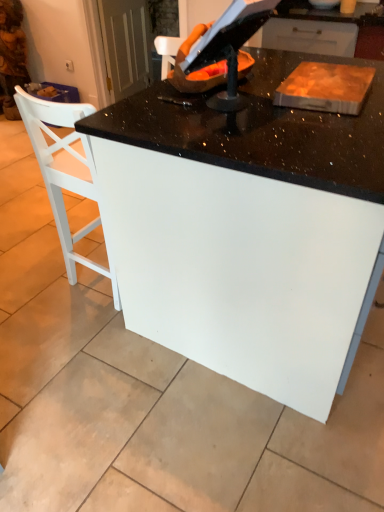
Question: From the image's perspective, is white wooden chair at left under white glossy table at center?

Choices:
 (A) no
 (B) yes

Answer: (A)

Question: Can you confirm if white wooden chair at left is positioned to the right of white glossy table at center?

Choices:
 (A) yes
 (B) no

Answer: (B)

Question: Is white wooden chair at left wider than white glossy table at center?

Choices:
 (A) yes
 (B) no

Answer: (B)

Question: Is white wooden chair at left taller than white glossy table at center?

Choices:
 (A) no
 (B) yes

Answer: (B)

Question: Could white glossy table at center be considered to be inside white wooden chair at left?

Choices:
 (A) no
 (B) yes

Answer: (A)

Question: Considering the relative sizes of white wooden chair at left and white glossy table at center in the image provided, is white wooden chair at left bigger than white glossy table at center?

Choices:
 (A) yes
 (B) no

Answer: (B)

Question: From the image's perspective, is white glossy table at center above white wooden chair at left?

Choices:
 (A) yes
 (B) no

Answer: (B)

Question: Is white glossy table at center wider than white wooden chair at left?

Choices:
 (A) no
 (B) yes

Answer: (B)

Question: Does white glossy table at center have a greater height compared to white wooden chair at left?

Choices:
 (A) no
 (B) yes

Answer: (A)

Question: Is white wooden chair at left completely or partially inside white glossy table at center?

Choices:
 (A) no
 (B) yes

Answer: (A)

Question: Considering the relative sizes of white glossy table at center and white wooden chair at left in the image provided, is white glossy table at center shorter than white wooden chair at left?

Choices:
 (A) yes
 (B) no

Answer: (A)

Question: Considering the relative sizes of white glossy table at center and white wooden chair at left in the image provided, is white glossy table at center thinner than white wooden chair at left?

Choices:
 (A) no
 (B) yes

Answer: (A)

Question: In terms of height, does white wooden chair at left look taller or shorter compared to white glossy table at center?

Choices:
 (A) tall
 (B) short

Answer: (A)